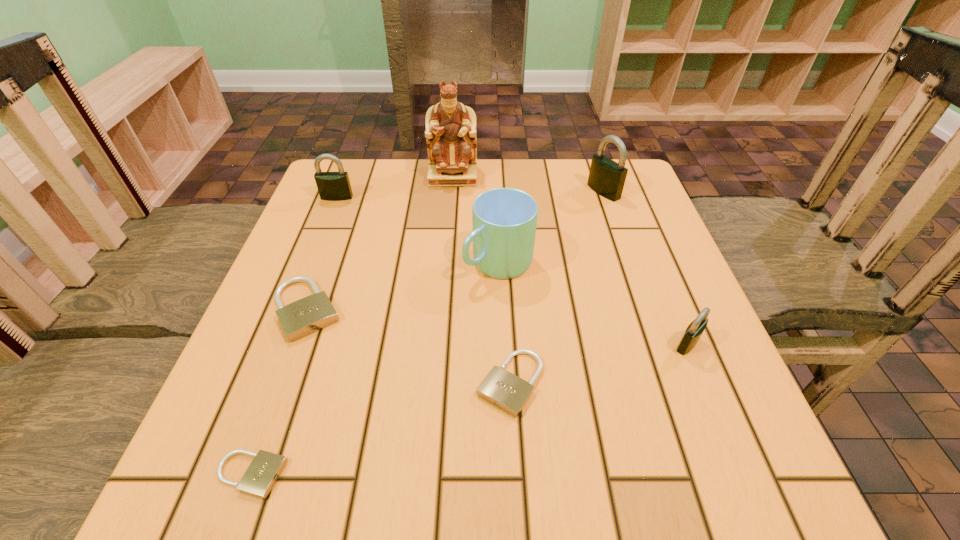
This screenshot has height=540, width=960. What are the coordinates of `the seventh tallest object` in the screenshot? It's located at (501, 388).

Image resolution: width=960 pixels, height=540 pixels. What are the coordinates of `the nearest object` in the screenshot? It's located at (260, 477).

The height and width of the screenshot is (540, 960). In order to click on the smallest beige padlock in this screenshot , I will do `click(260, 477)`.

Find the location of a particular element. The width and height of the screenshot is (960, 540). vacant position located on the front-facing side of the figurine is located at coordinates (445, 269).

I want to click on free region located 0.060m on the right of the biggest black padlock, so click(641, 191).

Locate an element on the screen. This screenshot has width=960, height=540. vacant area located 0.170m on the front of the mug is located at coordinates (502, 356).

Identify the location of vacant space located 0.370m on the right of the second tallest padlock. (501, 197).

Identify the location of free space located 0.380m on the left of the fourth shortest object. coord(459,344).

Where is `free spot located on the right of the farthest beige padlock`? free spot located on the right of the farthest beige padlock is located at coordinates (391, 310).

The height and width of the screenshot is (540, 960). Find the location of `free space located on the back of the fifth tallest padlock`. free space located on the back of the fifth tallest padlock is located at coordinates click(x=504, y=275).